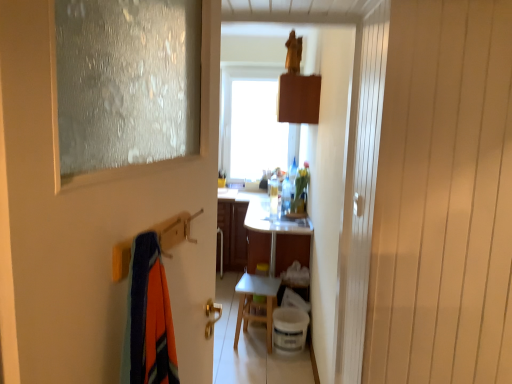
The width and height of the screenshot is (512, 384). What do you see at coordinates (286, 194) in the screenshot?
I see `translucent plastic bottle at center` at bounding box center [286, 194].

This screenshot has height=384, width=512. In order to click on white matte table at center in this screenshot , I will do `click(255, 303)`.

Where is `frosted glass door at left`? frosted glass door at left is located at coordinates (91, 222).

Considering the relative sizes of frosted glass door at left and white matte table at center in the image provided, is frosted glass door at left thinner than white matte table at center?

Yes, frosted glass door at left is thinner than white matte table at center.

Considering the positions of objects frosted glass door at left and white matte table at center in the image provided, who is more to the left, frosted glass door at left or white matte table at center?

Positioned to the left is frosted glass door at left.

Does frosted glass door at left have a smaller size compared to white matte table at center?

No, frosted glass door at left is not smaller than white matte table at center.

Is frosted glass door at left facing away from white matte table at center?

No, frosted glass door at left's orientation is not away from white matte table at center.

Can you confirm if translucent plastic bottle at center is thinner than frosted glass door at left?

No, translucent plastic bottle at center is not thinner than frosted glass door at left.

The image size is (512, 384). What are the coordinates of `bottle that is under the frosted glass door at left (from a real-world perspective)` in the screenshot? It's located at (286, 194).

Is the surface of translucent plastic bottle at center in direct contact with frosted glass door at left?

No, translucent plastic bottle at center is not beside frosted glass door at left.

Considering the positions of point (267, 342) and point (263, 317), is point (267, 342) closer or farther from the camera than point (263, 317)?

Point (267, 342) appears to be closer to the viewer than point (263, 317).

In terms of height, does white matte table at center look taller or shorter compared to white glossy vanity at center?

In the image, white matte table at center appears to be shorter than white glossy vanity at center.

Considering the sizes of objects white matte table at center and white glossy vanity at center in the image provided, who is smaller, white matte table at center or white glossy vanity at center?

Smaller between the two is white matte table at center.

From the image's perspective, is white matte table at center positioned above or below white glossy vanity at center?

Clearly, from the image's perspective, white matte table at center is below white glossy vanity at center.

Do you think translucent plastic bottle at center is within white glossy vanity at center, or outside of it?

translucent plastic bottle at center is not inside white glossy vanity at center, it's outside.

Which is more to the left, translucent plastic bottle at center or white glossy vanity at center?

white glossy vanity at center.

In terms of width, does translucent plastic bottle at center look wider or thinner when compared to white glossy vanity at center?

translucent plastic bottle at center is thinner than white glossy vanity at center.

Which is in front, point (283, 196) or point (269, 294)?

The point (269, 294) is more forward.

Is white glossy vanity at center not near frosted glass door at left?

Yes, white glossy vanity at center is far from frosted glass door at left.

Can we say white glossy vanity at center lies outside frosted glass door at left?

That's correct, white glossy vanity at center is outside of frosted glass door at left.

Considering the positions of objects white glossy vanity at center and frosted glass door at left in the image provided, who is more to the left, white glossy vanity at center or frosted glass door at left?

From the viewer's perspective, frosted glass door at left appears more on the left side.

How many degrees apart are the facing directions of translucent plastic bottle at center and white matte table at center?

They differ by 79.9 degrees in their facing directions.

Does translucent plastic bottle at center have a greater width compared to white matte table at center?

No, translucent plastic bottle at center is not wider than white matte table at center.

Can you confirm if translucent plastic bottle at center is positioned to the left of white matte table at center?

No.

Looking at this image, considering the positions of objects translucent plastic bottle at center and white matte table at center in the image provided, who is in front, translucent plastic bottle at center or white matte table at center?

white matte table at center is more forward.

From a real-world perspective, which object stands above the other?

In real-world perspective, frosted glass door at left is above.

Looking at this image, considering the positions of objects frosted glass door at left and translucent plastic bottle at center in the image provided, who is more to the right, frosted glass door at left or translucent plastic bottle at center?

translucent plastic bottle at center is more to the right.

Is frosted glass door at left beside translucent plastic bottle at center?

No, frosted glass door at left is not in contact with translucent plastic bottle at center.

Where is `door that appears above the white matte table at center (from a real-world perspective)`? door that appears above the white matte table at center (from a real-world perspective) is located at coordinates (91, 222).

Identify the location of door to the left of translucent plastic bottle at center. This screenshot has height=384, width=512. (91, 222).

Based on their spatial positions, is translucent plastic bottle at center or frosted glass door at left closer to white matte table at center?

Based on the image, translucent plastic bottle at center appears to be nearer to white matte table at center.

Which object lies further to the anchor point frosted glass door at left, translucent plastic bottle at center or white glossy vanity at center?

The object further to frosted glass door at left is translucent plastic bottle at center.

Estimate the real-world distances between objects in this image. Which object is closer to white glossy vanity at center, white matte table at center or frosted glass door at left?

white matte table at center is positioned closer to the anchor white glossy vanity at center.

When comparing their distances from translucent plastic bottle at center, does white glossy vanity at center or frosted glass door at left seem further?

frosted glass door at left is further to translucent plastic bottle at center.

Estimate the real-world distances between objects in this image. Which object is further from translucent plastic bottle at center, frosted glass door at left or white glossy vanity at center?

Among the two, frosted glass door at left is located further to translucent plastic bottle at center.

Considering their positions, is white matte table at center positioned further to white glossy vanity at center than translucent plastic bottle at center?

translucent plastic bottle at center is further to white glossy vanity at center.

Which object lies further to the anchor point white matte table at center, frosted glass door at left or translucent plastic bottle at center?

Based on the image, frosted glass door at left appears to be further to white matte table at center.

Which object lies further to the anchor point translucent plastic bottle at center, frosted glass door at left or white matte table at center?

frosted glass door at left is further to translucent plastic bottle at center.

Locate an element on the screen. vanity between frosted glass door at left and translucent plastic bottle at center from front to back is located at coordinates 269,261.

Where is `vanity between translucent plastic bottle at center and white matte table at center from top to bottom`? Image resolution: width=512 pixels, height=384 pixels. vanity between translucent plastic bottle at center and white matte table at center from top to bottom is located at coordinates (269, 261).

Where is `table between frosted glass door at left and translucent plastic bottle at center in the front-back direction`? This screenshot has height=384, width=512. table between frosted glass door at left and translucent plastic bottle at center in the front-back direction is located at coordinates [x=255, y=303].

Where is `table between frosted glass door at left and white glossy vanity at center along the z-axis`? Image resolution: width=512 pixels, height=384 pixels. table between frosted glass door at left and white glossy vanity at center along the z-axis is located at coordinates (255, 303).